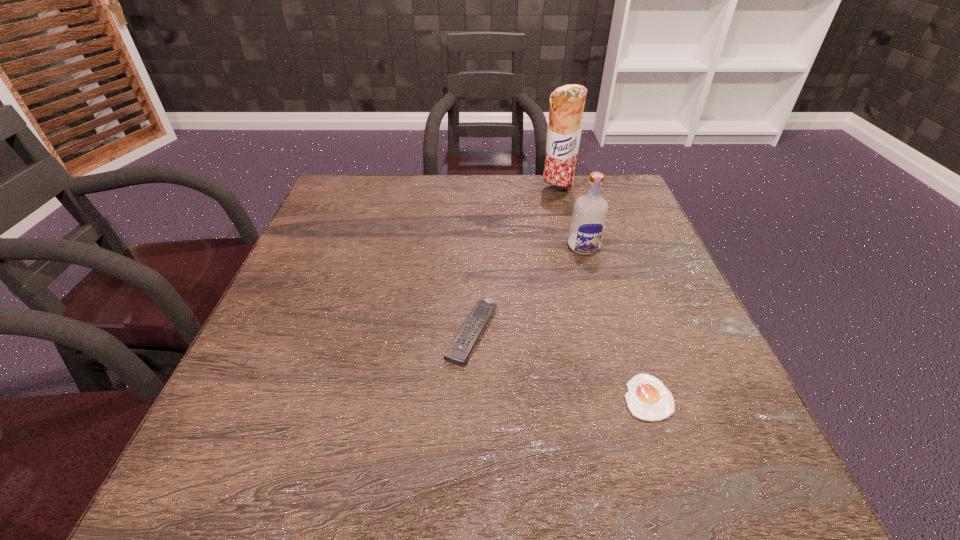
In order to click on free space located on the right of the leftmost object in this screenshot , I will do `click(647, 333)`.

Locate an element on the screen. This screenshot has height=540, width=960. vacant space located 0.070m on the right of the shortest object is located at coordinates (713, 397).

Identify the location of object that is at the far edge. coord(567,102).

Identify the location of vodka located in the right edge section of the desktop. (589, 215).

Find the location of a particular element. egg yolk that is at the right edge is located at coordinates (648, 399).

Where is `free space at the far edge of the desktop`? free space at the far edge of the desktop is located at coordinates (475, 193).

The image size is (960, 540). I want to click on free space at the near edge of the desktop, so click(x=440, y=467).

Identify the location of vacant area at the left edge of the desktop. Image resolution: width=960 pixels, height=540 pixels. (313, 255).

Find the location of `blank area at the right edge`. blank area at the right edge is located at coordinates (673, 334).

Image resolution: width=960 pixels, height=540 pixels. In the image, there is a desktop. Identify the location of free space at the far left corner. (349, 203).